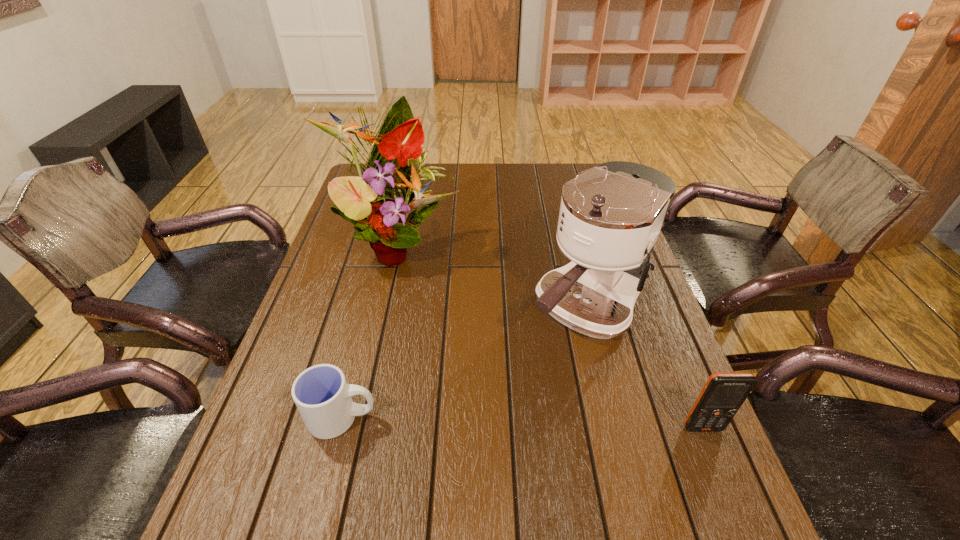
At what (x,y) coordinates should I click in order to perform the action: click on vacant space located 0.250m on the front-facing side of the bouquet. Please return your answer as a coordinate pair (x, y). This screenshot has width=960, height=540. Looking at the image, I should click on (474, 325).

Find the location of a particular element. This screenshot has height=540, width=960. vacant space located 0.390m on the front-facing side of the bouquet is located at coordinates (506, 364).

This screenshot has width=960, height=540. I want to click on cup that is positioned at the left edge, so coord(324,399).

Locate an element on the screen. bouquet that is at the left edge is located at coordinates (380, 203).

This screenshot has height=540, width=960. Find the location of `cellular telephone located at the right edge`. cellular telephone located at the right edge is located at coordinates (723, 394).

Where is `coffee maker located at the right edge`? The width and height of the screenshot is (960, 540). coffee maker located at the right edge is located at coordinates (610, 217).

Locate an element on the screen. This screenshot has width=960, height=540. free space at the far edge is located at coordinates (501, 187).

In order to click on free region at the near edge of the desktop in this screenshot , I will do `click(332, 455)`.

At what (x,y) coordinates should I click in order to perform the action: click on vacant space at the left edge. Please return your answer as a coordinate pair (x, y). The height and width of the screenshot is (540, 960). Looking at the image, I should click on (338, 357).

This screenshot has width=960, height=540. In order to click on vacant space at the right edge of the desktop in this screenshot , I will do `click(622, 357)`.